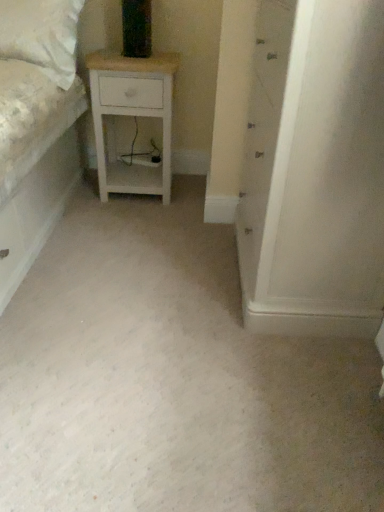
Question: From the image's perspective, does white wood nightstand at center appear lower than white matte cabinet at center?

Choices:
 (A) no
 (B) yes

Answer: (A)

Question: Is white wood nightstand at center shorter than white matte cabinet at center?

Choices:
 (A) yes
 (B) no

Answer: (A)

Question: Considering the relative sizes of white wood nightstand at center and white matte cabinet at center in the image provided, is white wood nightstand at center wider than white matte cabinet at center?

Choices:
 (A) yes
 (B) no

Answer: (B)

Question: From a real-world perspective, is white wood nightstand at center positioned over white matte cabinet at center based on gravity?

Choices:
 (A) yes
 (B) no

Answer: (B)

Question: Is white wood nightstand at center next to white matte cabinet at center?

Choices:
 (A) no
 (B) yes

Answer: (A)

Question: Can you confirm if white wood nightstand at center is bigger than white matte cabinet at center?

Choices:
 (A) no
 (B) yes

Answer: (A)

Question: Can white wood nightstand at center be found inside white matte cabinet at center?

Choices:
 (A) yes
 (B) no

Answer: (B)

Question: From a real-world perspective, does white matte cabinet at center sit lower than white wood nightstand at center?

Choices:
 (A) no
 (B) yes

Answer: (A)

Question: Does white matte cabinet at center have a greater width compared to white wood nightstand at center?

Choices:
 (A) yes
 (B) no

Answer: (A)

Question: Is white matte cabinet at center not close to white wood nightstand at center?

Choices:
 (A) no
 (B) yes

Answer: (B)

Question: From a real-world perspective, is white matte cabinet at center positioned over white wood nightstand at center based on gravity?

Choices:
 (A) no
 (B) yes

Answer: (B)

Question: From the image's perspective, does white matte cabinet at center appear higher than white wood nightstand at center?

Choices:
 (A) yes
 (B) no

Answer: (B)

Question: Relative to white wood nightstand at center, is white matte cabinet at center in front or behind?

Choices:
 (A) behind
 (B) front

Answer: (B)